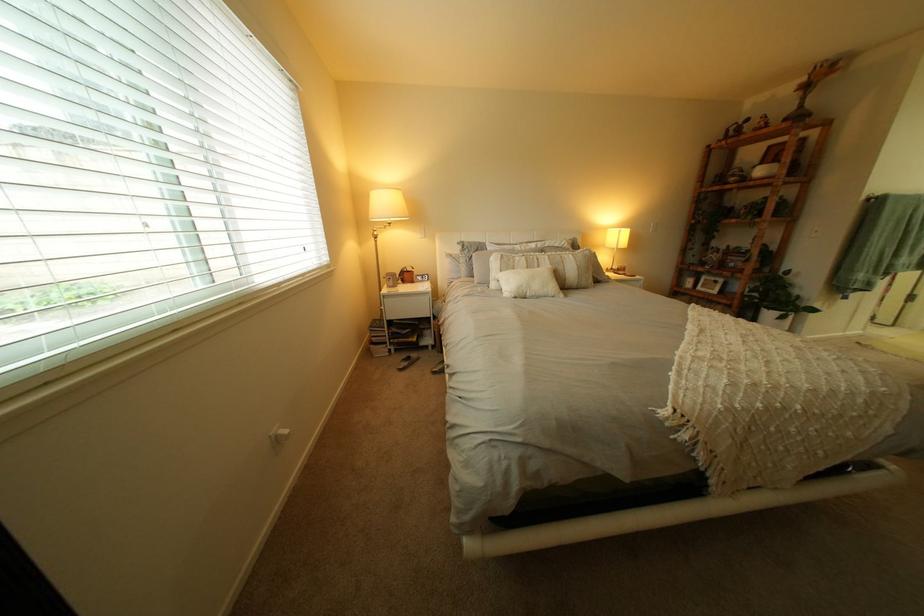
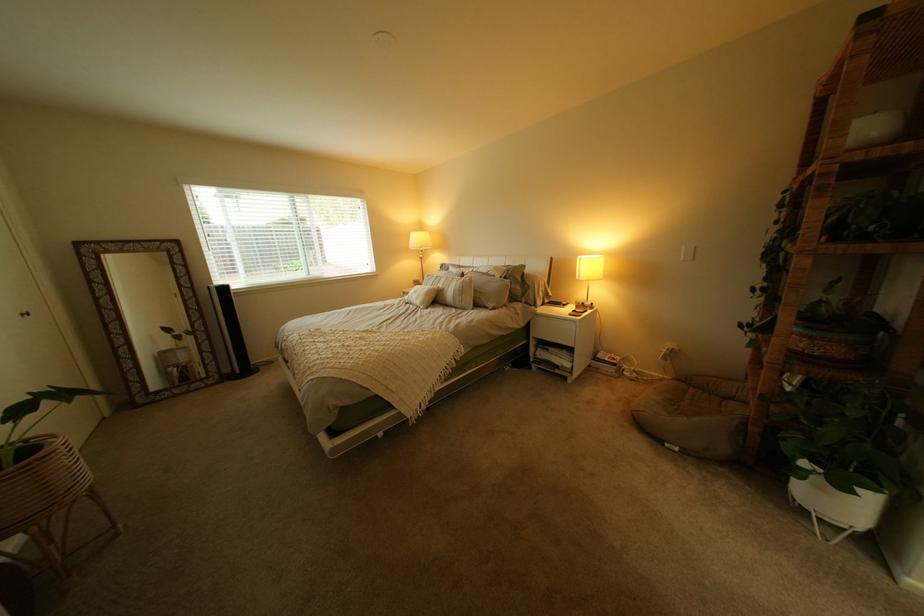
Where in the second image is the point corresponding to [770,270] from the first image?

(805, 354)